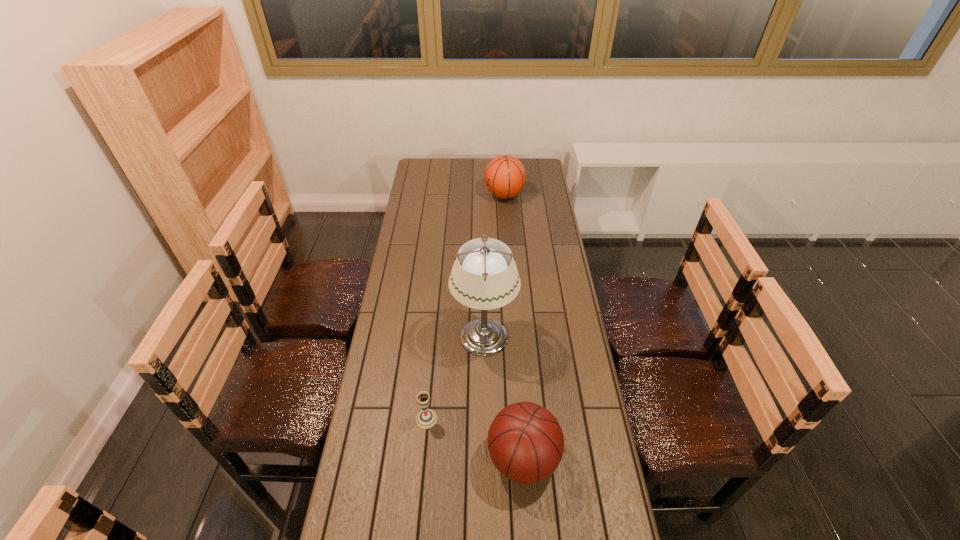
Find the location of `lampshade`. lampshade is located at coordinates (484, 281).

Find the location of a particular element. the tallest object is located at coordinates (484, 281).

What are the coordinates of `the farthest object` in the screenshot? It's located at (505, 176).

Image resolution: width=960 pixels, height=540 pixels. Identify the location of the nearer basketball. (525, 441).

The width and height of the screenshot is (960, 540). I want to click on chalice, so click(x=426, y=418).

Identify the location of the shortest object. (426, 418).

This screenshot has height=540, width=960. Find the location of `free space located 0.230m on the lampshade of the tallest object`. free space located 0.230m on the lampshade of the tallest object is located at coordinates click(x=390, y=336).

In order to click on free space located 0.200m on the lampshade of the tallest object in this screenshot , I will do `click(397, 336)`.

Locate an element on the screen. This screenshot has width=960, height=540. free space located 0.110m on the lampshade of the tallest object is located at coordinates coord(422,336).

Identify the location of free region located 0.190m on the left of the farthest object. Image resolution: width=960 pixels, height=540 pixels. tap(447, 195).